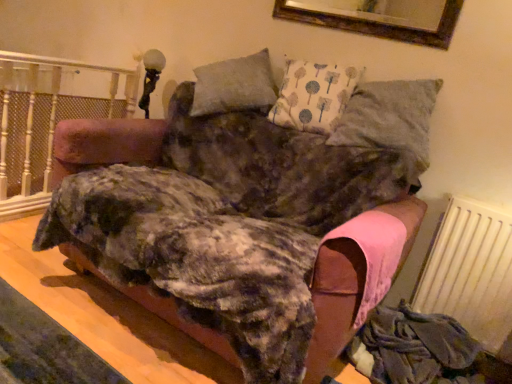
Question: Does white painted wood at left appear on the left side of velvet pink sofa at center?

Choices:
 (A) yes
 (B) no

Answer: (A)

Question: Is white painted wood at left oriented away from velvet pink sofa at center?

Choices:
 (A) yes
 (B) no

Answer: (A)

Question: Does white painted wood at left appear on the right side of velvet pink sofa at center?

Choices:
 (A) no
 (B) yes

Answer: (A)

Question: From the image's perspective, does white painted wood at left appear lower than velvet pink sofa at center?

Choices:
 (A) yes
 (B) no

Answer: (B)

Question: Is white painted wood at left beside velvet pink sofa at center?

Choices:
 (A) yes
 (B) no

Answer: (B)

Question: Based on their sizes in the image, would you say velvet pink sofa at center is bigger or smaller than white painted wood at left?

Choices:
 (A) big
 (B) small

Answer: (A)

Question: From a real-world perspective, is velvet pink sofa at center positioned above or below white painted wood at left?

Choices:
 (A) below
 (B) above

Answer: (B)

Question: From the image's perspective, is velvet pink sofa at center positioned above or below white painted wood at left?

Choices:
 (A) above
 (B) below

Answer: (B)

Question: Considering the positions of point (197, 132) and point (3, 134), is point (197, 132) closer or farther from the camera than point (3, 134)?

Choices:
 (A) farther
 (B) closer

Answer: (A)

Question: From a real-world perspective, is white painted wood at left physically located above or below white textured radiator at lower right?

Choices:
 (A) above
 (B) below

Answer: (B)

Question: Does point (2, 142) appear closer or farther from the camera than point (448, 281)?

Choices:
 (A) closer
 (B) farther

Answer: (B)

Question: From the image's perspective, relative to white textured radiator at lower right, is white painted wood at left above or below?

Choices:
 (A) below
 (B) above

Answer: (B)

Question: Looking at their shapes, would you say white painted wood at left is wider or thinner than white textured radiator at lower right?

Choices:
 (A) thin
 (B) wide

Answer: (A)

Question: From a real-world perspective, is white painted wood at left positioned above or below textured gray pillow at upper right?

Choices:
 (A) below
 (B) above

Answer: (A)

Question: Is white painted wood at left bigger or smaller than textured gray pillow at upper right?

Choices:
 (A) small
 (B) big

Answer: (A)